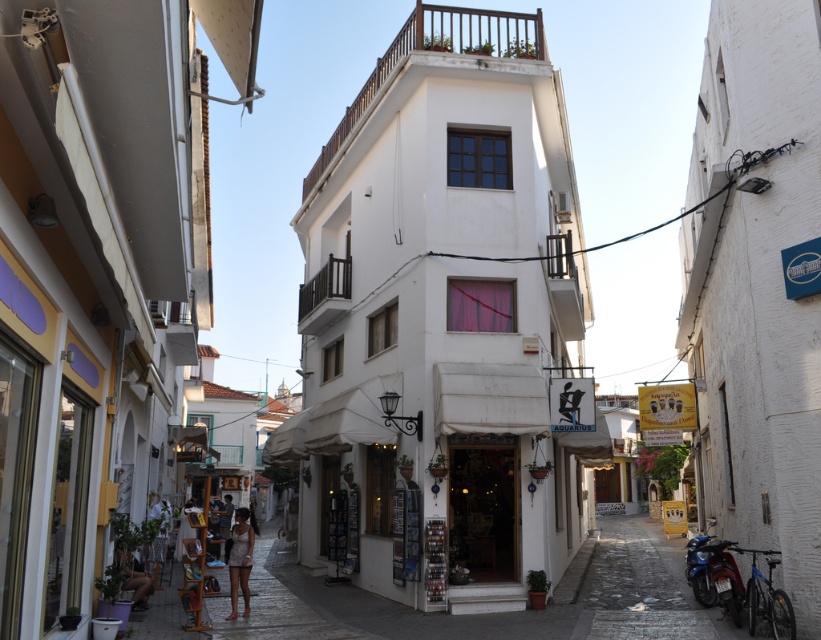
Question: Which of the following is the farthest from the observer?

Choices:
 (A) white cotton dress at lower left
 (B) white textured dress at center

Answer: (B)

Question: Can you confirm if white textured dress at center is thinner than white cotton dress at lower left?

Choices:
 (A) yes
 (B) no

Answer: (A)

Question: Does white textured dress at center appear under white cotton dress at lower left?

Choices:
 (A) no
 (B) yes

Answer: (B)

Question: Among these objects, which one is farthest from the camera?

Choices:
 (A) white cotton dress at lower left
 (B) white textured dress at center

Answer: (B)

Question: Does white textured dress at center appear under white cotton dress at lower left?

Choices:
 (A) no
 (B) yes

Answer: (B)